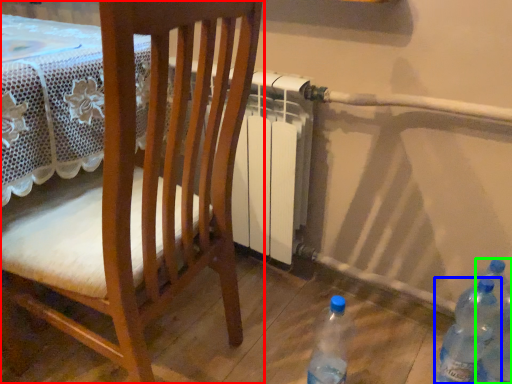
Question: Based on their relative distances, which object is farther from chair (highlighted by a red box)? Choose from bottle (highlighted by a blue box) and bottle (highlighted by a green box).

Choices:
 (A) bottle
 (B) bottle

Answer: (B)